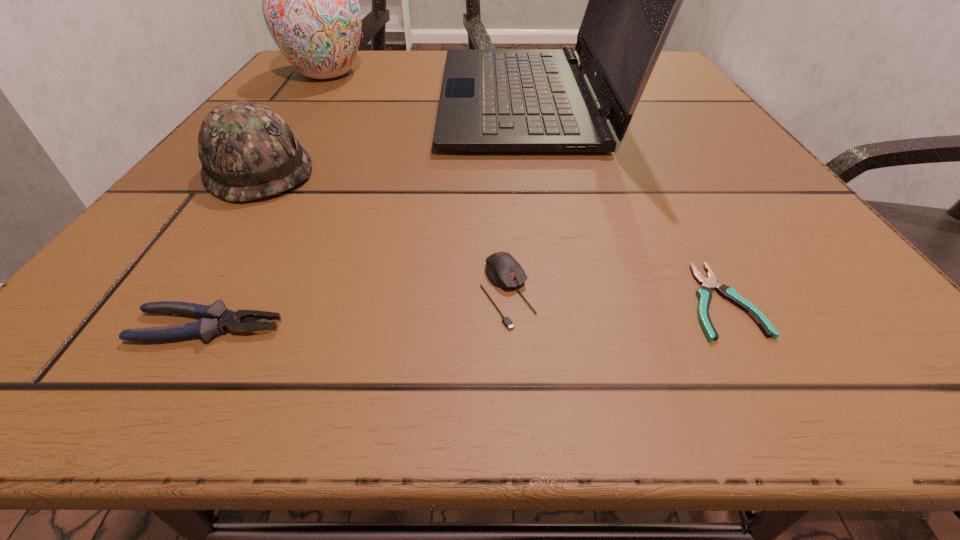
Locate an element on the screen. This screenshot has height=540, width=960. free point between the tallest object and the mouse is located at coordinates (519, 195).

Where is `object that stands as the second closest to the headwear`? This screenshot has width=960, height=540. object that stands as the second closest to the headwear is located at coordinates (215, 318).

You are a GUI agent. You are given a task and a screenshot of the screen. Output one action in this format:
    pyautogui.click(x=<x>, y=<y>)
    Task: Click on the second closest object to the laptop computer
    
    Given the screenshot: What is the action you would take?
    pyautogui.click(x=247, y=151)